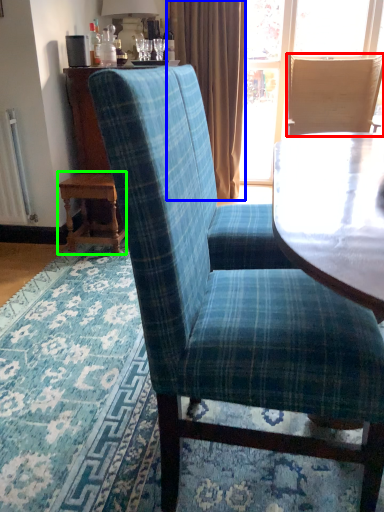
Question: Which object is the farthest from chair (highlighted by a red box)? Choose among these: curtain (highlighted by a blue box) or table (highlighted by a green box).

Choices:
 (A) curtain
 (B) table

Answer: (B)